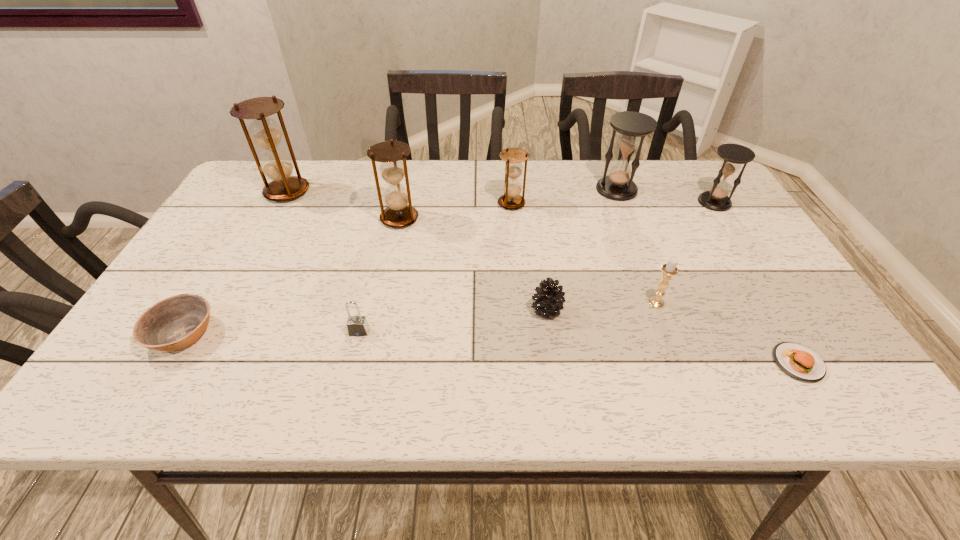
Where is `empty location between the left black hourglass and the shortest object`? This screenshot has width=960, height=540. empty location between the left black hourglass and the shortest object is located at coordinates click(708, 276).

Find the location of a particular element. The image size is (960, 540). free space between the ninth tallest object and the smallest brown hourglass is located at coordinates pyautogui.click(x=348, y=268).

This screenshot has width=960, height=540. Identify the location of free point between the sixth tallest object and the rightmost hourglass. [685, 252].

The height and width of the screenshot is (540, 960). In order to click on free space between the rightmost hourglass and the bowl in this screenshot , I will do `click(448, 268)`.

Locate an element on the screen. The width and height of the screenshot is (960, 540). free space between the smaller black hourglass and the fourth hourglass from left to right is located at coordinates (665, 196).

Locate an element on the screen. This screenshot has width=960, height=540. empty space that is in between the candle holder and the padlock is located at coordinates (508, 317).

The width and height of the screenshot is (960, 540). I want to click on vacant area that lies between the ninth tallest object and the sixth tallest object, so click(420, 318).

Locate an element on the screen. Image resolution: width=960 pixels, height=540 pixels. free spot between the rightmost hourglass and the candle holder is located at coordinates (685, 252).

The width and height of the screenshot is (960, 540). Find the location of `object that is the closest to the rightmost brown hourglass`. object that is the closest to the rightmost brown hourglass is located at coordinates (632, 127).

Choose which object is the ninth nearest neighbor to the second biggest brown hourglass. Please provide its 2D coordinates. Your answer should be formatted as a tuple, i.e. [(x, y)], where the tuple contains the x and y coordinates of a point satisfying the conditions above.

[(798, 361)]